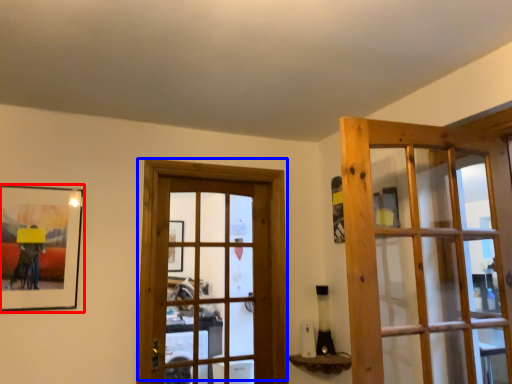
Question: Among these objects, which one is nearest to the camera, picture frame (highlighted by a red box) or door (highlighted by a blue box)?

Choices:
 (A) picture frame
 (B) door

Answer: (A)